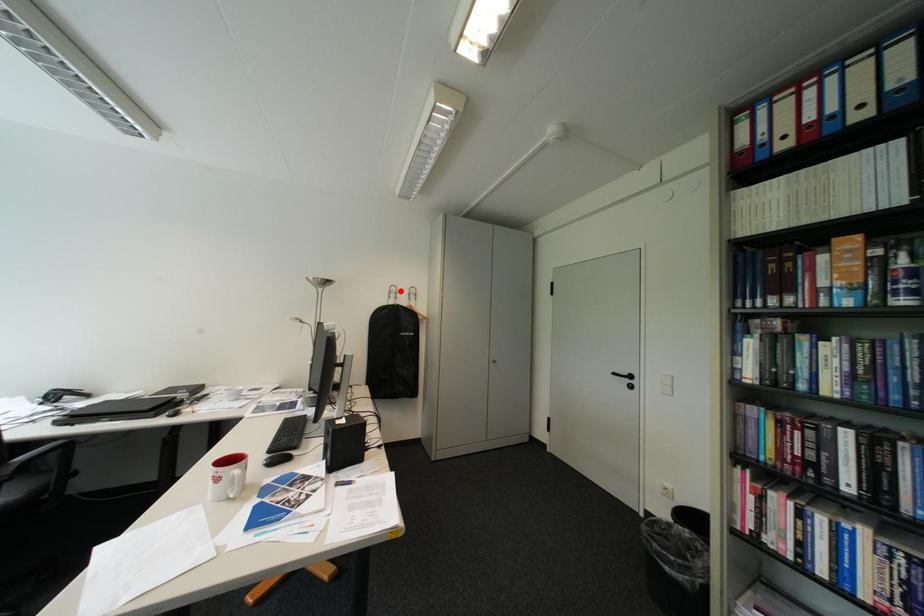
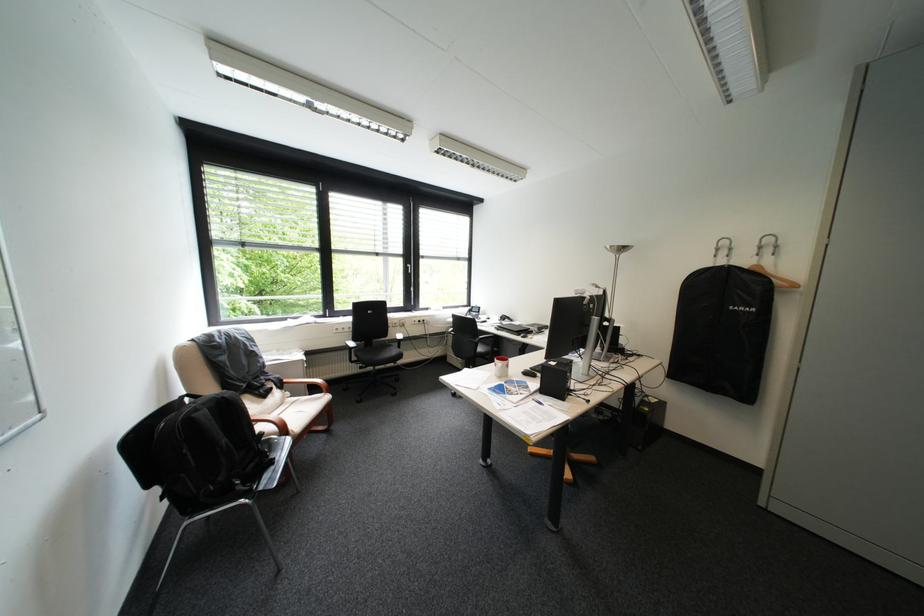
In the second image, find the point that corresponds to the highlighted location in the first image.

(727, 246)